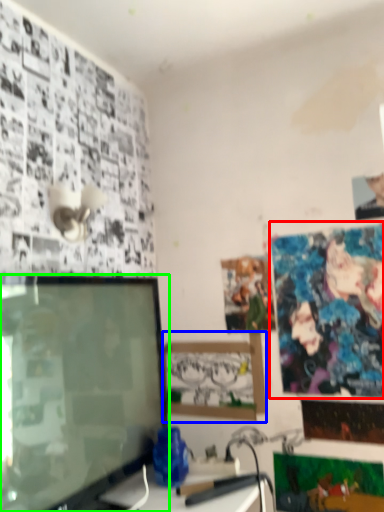
Question: Considering the real-world distances, which object is farthest from poster page (highlighted by a red box)? picture frame (highlighted by a blue box) or television (highlighted by a green box)?

Choices:
 (A) picture frame
 (B) television

Answer: (B)